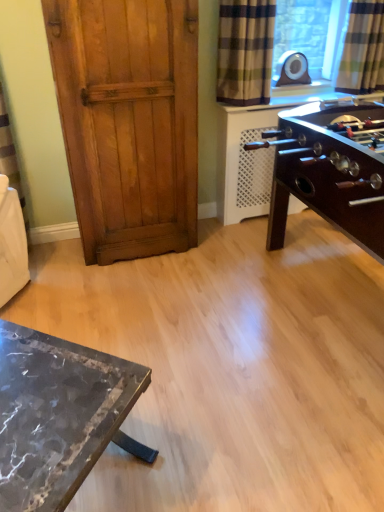
The image size is (384, 512). What do you see at coordinates (128, 121) in the screenshot?
I see `wooden door at left` at bounding box center [128, 121].

Measure the distance between point (229,88) and camera.

A distance of 8.68 feet exists between point (229,88) and camera.

What do you see at coordinates (292, 69) in the screenshot? Image resolution: width=384 pixels, height=512 pixels. I see `matte black speaker at upper right` at bounding box center [292, 69].

Find the location of a particular element. The image size is (384, 512). checkered fabric curtain at upper right, which appears as the 1th curtain when viewed from the right is located at coordinates (361, 49).

The width and height of the screenshot is (384, 512). I want to click on table on the left of the wooden door at left, so click(x=59, y=415).

From the image's perspective, which one is positioned lower, wooden door at left or marble table at lower left?

marble table at lower left appears lower in the image.

Is wooden door at left located outside marble table at lower left?

Yes.

Which object is more forward, wooden door at left or marble table at lower left?

marble table at lower left is more forward.

Consider the image. Which is less distant, (x=372, y=85) or (x=68, y=500)?

Point (x=68, y=500)

Does checkered fabric curtain at upper right, which appears as the 1th curtain when viewed from the right, touch marble table at lower left?

No, checkered fabric curtain at upper right, which appears as the 1th curtain when viewed from the right, is not next to marble table at lower left.

Considering the relative sizes of checkered fabric curtain at upper right, which appears as the 1th curtain when viewed from the right, and marble table at lower left in the image provided, is checkered fabric curtain at upper right, which appears as the 1th curtain when viewed from the right, smaller than marble table at lower left?

Yes.

Is marble table at lower left placed right next to wooden door at left?

No, marble table at lower left is not with wooden door at left.

Considering the relative sizes of marble table at lower left and wooden door at left in the image provided, is marble table at lower left shorter than wooden door at left?

Yes.

Which object is closer to the camera taking this photo, marble table at lower left or wooden door at left?

marble table at lower left.

Looking at this image, from the image's perspective, which one is positioned higher, marble table at lower left or wooden door at left?

wooden door at left.

Considering the points (236, 16) and (92, 397), which point is in front, point (236, 16) or point (92, 397)?

The point (92, 397) is closer to the camera.

In order to click on the 1st curtain above when counting from the marble table at lower left (from the image's perspective) in this screenshot , I will do `click(245, 51)`.

Between plaid fabric curtain at upper right, which is the 1th curtain in left-to-right order, and marble table at lower left, which one has smaller width?

plaid fabric curtain at upper right, which is the 1th curtain in left-to-right order.

From a real-world perspective, is matte black speaker at upper right located beneath marble table at lower left?

No.

From the image's perspective, is matte black speaker at upper right below marble table at lower left?

Actually, matte black speaker at upper right appears above marble table at lower left in the image.

Between matte black speaker at upper right and marble table at lower left, which one is positioned behind?

matte black speaker at upper right is more distant.

How different are the orientations of matte black speaker at upper right and marble table at lower left in degrees?

48 degrees.

Can you confirm if plaid fabric curtain at upper right, the second curtain in the right-to-left sequence, is taller than matte black speaker at upper right?

Yes, plaid fabric curtain at upper right, the second curtain in the right-to-left sequence, is taller than matte black speaker at upper right.

Looking at the image, does plaid fabric curtain at upper right, which is the 1th curtain in left-to-right order, seem bigger or smaller compared to matte black speaker at upper right?

plaid fabric curtain at upper right, which is the 1th curtain in left-to-right order, is bigger than matte black speaker at upper right.

Is plaid fabric curtain at upper right, the second curtain in the right-to-left sequence, at the right side of matte black speaker at upper right?

No, plaid fabric curtain at upper right, the second curtain in the right-to-left sequence, is not to the right of matte black speaker at upper right.

From the image's perspective, which one is positioned lower, plaid fabric curtain at upper right, the second curtain in the right-to-left sequence, or matte black speaker at upper right?

plaid fabric curtain at upper right, the second curtain in the right-to-left sequence, from the image's perspective.

Is point (300, 59) behind point (351, 69)?

Yes, it is.

What's the angular difference between matte black speaker at upper right and checkered fabric curtain at upper right, the second curtain in the left-to-right sequence,'s facing directions?

There is a 2.53-degree angle between the facing directions of matte black speaker at upper right and checkered fabric curtain at upper right, the second curtain in the left-to-right sequence.

This screenshot has width=384, height=512. In order to click on appliance that appears on the left of checkered fabric curtain at upper right, the second curtain in the left-to-right sequence in this screenshot , I will do `click(292, 69)`.

The width and height of the screenshot is (384, 512). Identify the location of table below the wooden door at left (from a real-world perspective). (59, 415).

Locate an element on the screen. The width and height of the screenshot is (384, 512). table on the left of the checkered fabric curtain at upper right, which appears as the 1th curtain when viewed from the right is located at coordinates (59, 415).

Estimate the real-world distances between objects in this image. Which object is further from matte black speaker at upper right, checkered fabric curtain at upper right, which appears as the 1th curtain when viewed from the right, or plaid fabric curtain at upper right, the second curtain in the right-to-left sequence?

Among the two, plaid fabric curtain at upper right, the second curtain in the right-to-left sequence, is located further to matte black speaker at upper right.

Based on their spatial positions, is plaid fabric curtain at upper right, the second curtain in the right-to-left sequence, or marble table at lower left closer to checkered fabric curtain at upper right, which appears as the 1th curtain when viewed from the right?

The object closer to checkered fabric curtain at upper right, which appears as the 1th curtain when viewed from the right, is plaid fabric curtain at upper right, the second curtain in the right-to-left sequence.

Looking at the image, which one is located further to plaid fabric curtain at upper right, which is the 1th curtain in left-to-right order, marble table at lower left or wooden door at left?

Based on the image, marble table at lower left appears to be further to plaid fabric curtain at upper right, which is the 1th curtain in left-to-right order.

Based on their spatial positions, is checkered fabric curtain at upper right, which appears as the 1th curtain when viewed from the right, or marble table at lower left closer to plaid fabric curtain at upper right, which is the 1th curtain in left-to-right order?

checkered fabric curtain at upper right, which appears as the 1th curtain when viewed from the right.

When comparing their distances from matte black speaker at upper right, does checkered fabric curtain at upper right, which appears as the 1th curtain when viewed from the right, or wooden door at left seem closer?

checkered fabric curtain at upper right, which appears as the 1th curtain when viewed from the right, is positioned closer to the anchor matte black speaker at upper right.

Considering their positions, is matte black speaker at upper right positioned closer to marble table at lower left than plaid fabric curtain at upper right, the second curtain in the right-to-left sequence?

The object closer to marble table at lower left is plaid fabric curtain at upper right, the second curtain in the right-to-left sequence.

Based on their spatial positions, is wooden door at left or matte black speaker at upper right closer to plaid fabric curtain at upper right, which is the 1th curtain in left-to-right order?

Among the two, matte black speaker at upper right is located nearer to plaid fabric curtain at upper right, which is the 1th curtain in left-to-right order.

Considering their positions, is checkered fabric curtain at upper right, the second curtain in the left-to-right sequence, positioned closer to plaid fabric curtain at upper right, the second curtain in the right-to-left sequence, than wooden door at left?

wooden door at left is positioned closer to the anchor plaid fabric curtain at upper right, the second curtain in the right-to-left sequence.

The height and width of the screenshot is (512, 384). I want to click on appliance located between plaid fabric curtain at upper right, which is the 1th curtain in left-to-right order, and checkered fabric curtain at upper right, which appears as the 1th curtain when viewed from the right, in the left-right direction, so click(x=292, y=69).

Where is `appliance between wooden door at left and checkered fabric curtain at upper right, the second curtain in the left-to-right sequence`? This screenshot has height=512, width=384. appliance between wooden door at left and checkered fabric curtain at upper right, the second curtain in the left-to-right sequence is located at coordinates (292, 69).

Where is `curtain that lies between checkered fabric curtain at upper right, which appears as the 1th curtain when viewed from the right, and marble table at lower left from top to bottom`? The image size is (384, 512). curtain that lies between checkered fabric curtain at upper right, which appears as the 1th curtain when viewed from the right, and marble table at lower left from top to bottom is located at coordinates (245, 51).

Locate an element on the screen. curtain located between wooden door at left and checkered fabric curtain at upper right, the second curtain in the left-to-right sequence, in the left-right direction is located at coordinates (245, 51).